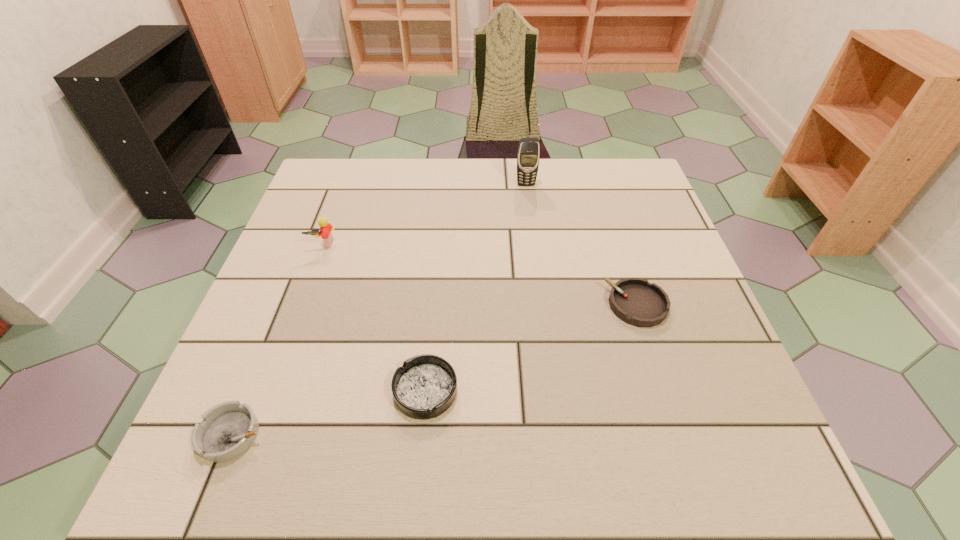
In the image, there is a desktop. At what (x,y) coordinates should I click in order to perform the action: click on vacant space at the left edge. Please return your answer as a coordinate pair (x, y). Looking at the image, I should click on (334, 232).

What are the coordinates of `free space at the right edge of the desktop` in the screenshot? It's located at (708, 389).

In the image, there is a desktop. Identify the location of vacant space at the far left corner. The image size is (960, 540). (306, 205).

Where is `vacant region at the near left corner`? This screenshot has height=540, width=960. vacant region at the near left corner is located at coordinates (235, 474).

Where is `free space at the far right corner of the desktop`? Image resolution: width=960 pixels, height=540 pixels. free space at the far right corner of the desktop is located at coordinates (634, 196).

Locate an element on the screen. The height and width of the screenshot is (540, 960). vacant space at the near right corner of the desktop is located at coordinates (714, 466).

Identify the location of vacant space that's between the second object from right to left and the second farthest object. The image size is (960, 540). (424, 214).

This screenshot has width=960, height=540. I want to click on vacant point located between the leftmost ashtray and the second farthest object, so click(x=278, y=340).

This screenshot has width=960, height=540. I want to click on free point between the leftmost ashtray and the fourth object from left to right, so click(379, 309).

The width and height of the screenshot is (960, 540). What are the coordinates of `free space between the tallest object and the second ashtray from right to left` in the screenshot? It's located at (476, 287).